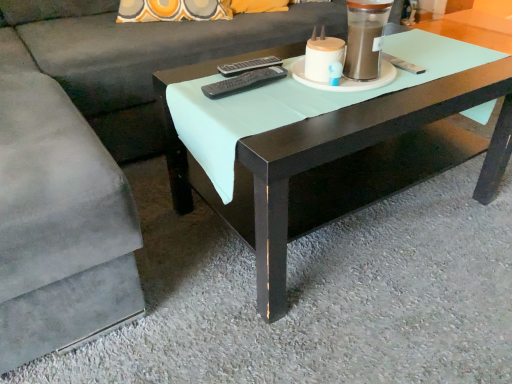
Find the location of a particular element. The width and height of the screenshot is (512, 384). free spot to the right of black plastic remote at center, which is the 1th remote in back-to-front order is located at coordinates (307, 77).